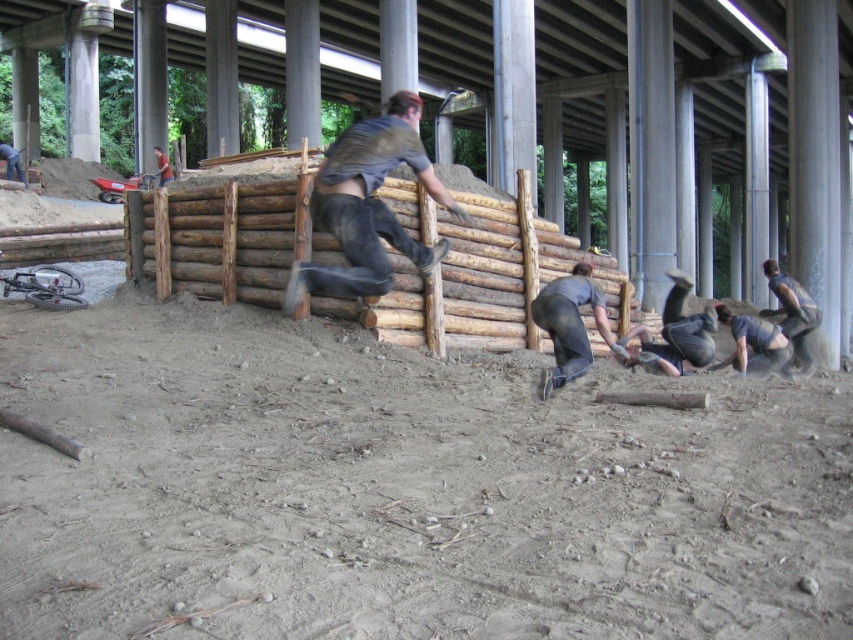
Between point (374, 173) and point (573, 362), which one is positioned in front?

Point (374, 173) is more forward.

Who is taller, brown leather boots at center or dark gray jeans at lower center?

Standing taller between the two is dark gray jeans at lower center.

Find the location of a particular element. The image size is (853, 640). brown leather boots at center is located at coordinates (368, 205).

Does brown leather boots at center have a smaller size compared to dark gray fabric pants at lower right?

Correct, brown leather boots at center occupies less space than dark gray fabric pants at lower right.

Does point (389, 288) lie behind point (782, 289)?

No, it is in front of (782, 289).

You are a GUI agent. You are given a task and a screenshot of the screen. Output one action in this format:
    pyautogui.click(x=<x>, y=<y>)
    Task: Click on the brown leather boots at center
    
    Given the screenshot: What is the action you would take?
    pyautogui.click(x=368, y=205)

The width and height of the screenshot is (853, 640). What do you see at coordinates (675, 336) in the screenshot?
I see `dark gray fabric pants at lower center` at bounding box center [675, 336].

Which is behind, point (699, 316) or point (747, 317)?

Positioned behind is point (747, 317).

Locate an element on the screen. The height and width of the screenshot is (640, 853). dark gray fabric pants at lower center is located at coordinates (675, 336).